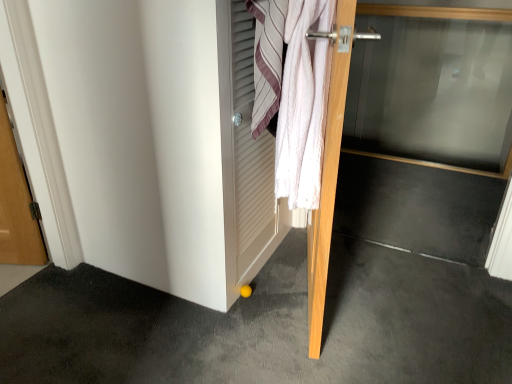
Question: Is white textured towel at center bigger than transparent glass door at center, marked as the 2th door in a left-to-right arrangement?

Choices:
 (A) yes
 (B) no

Answer: (B)

Question: Can you confirm if white textured towel at center is smaller than transparent glass door at center, placed as the first door when sorted from right to left?

Choices:
 (A) yes
 (B) no

Answer: (A)

Question: Can you confirm if white textured towel at center is taller than transparent glass door at center, placed as the first door when sorted from right to left?

Choices:
 (A) no
 (B) yes

Answer: (A)

Question: Is white textured towel at center completely or partially outside of transparent glass door at center, placed as the first door when sorted from right to left?

Choices:
 (A) yes
 (B) no

Answer: (A)

Question: From the image's perspective, is white textured towel at center on top of transparent glass door at center, placed as the first door when sorted from right to left?

Choices:
 (A) no
 (B) yes

Answer: (A)

Question: From a real-world perspective, relative to transparent glass door at center, placed as the first door when sorted from right to left, is white textured towel at center vertically above or below?

Choices:
 (A) below
 (B) above

Answer: (B)

Question: Is white textured towel at center inside the boundaries of transparent glass door at center, marked as the 2th door in a left-to-right arrangement, or outside?

Choices:
 (A) inside
 (B) outside

Answer: (B)

Question: In terms of height, does white textured towel at center look taller or shorter compared to transparent glass door at center, marked as the 2th door in a left-to-right arrangement?

Choices:
 (A) short
 (B) tall

Answer: (A)

Question: Is white textured towel at center wider or thinner than transparent glass door at center, marked as the 2th door in a left-to-right arrangement?

Choices:
 (A) wide
 (B) thin

Answer: (A)

Question: From a real-world perspective, is yellow rubber ball at lower center above or below white cotton towel at upper right?

Choices:
 (A) below
 (B) above

Answer: (A)

Question: From the image's perspective, relative to white cotton towel at upper right, is yellow rubber ball at lower center above or below?

Choices:
 (A) above
 (B) below

Answer: (B)

Question: Would you say yellow rubber ball at lower center is to the left or to the right of white cotton towel at upper right in the picture?

Choices:
 (A) left
 (B) right

Answer: (A)

Question: Considering the positions of yellow rubber ball at lower center and white cotton towel at upper right in the image, is yellow rubber ball at lower center taller or shorter than white cotton towel at upper right?

Choices:
 (A) short
 (B) tall

Answer: (A)

Question: Is wooden door at center, acting as the second door starting from the right, in front of or behind white cotton towel at upper right in the image?

Choices:
 (A) front
 (B) behind

Answer: (A)

Question: Is point tap(334, 142) closer or farther from the camera than point tap(293, 21)?

Choices:
 (A) farther
 (B) closer

Answer: (A)